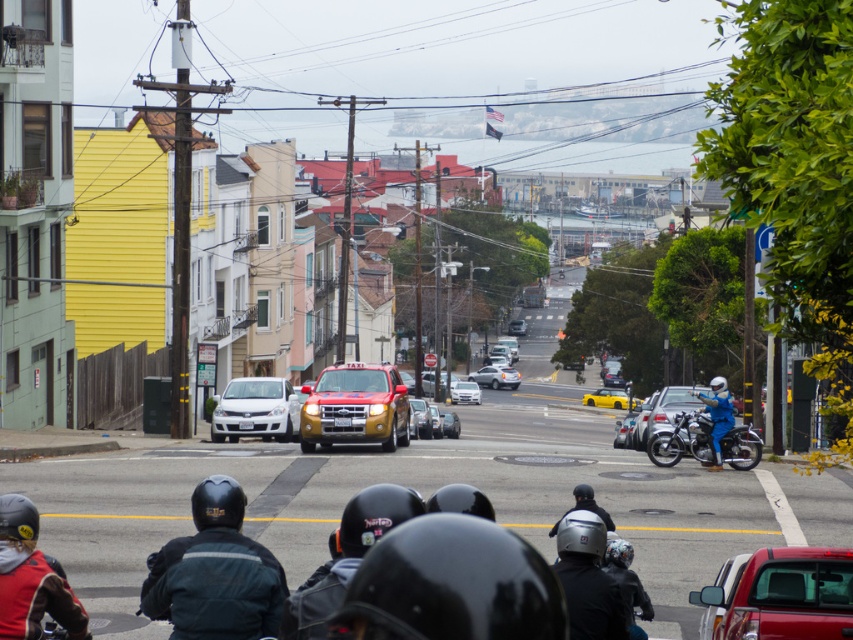
Can you confirm if satin white sedan at center is taller than satin silver sedan at center?

No.

Between satin white sedan at center and satin silver sedan at center, which one is positioned lower?

satin silver sedan at center is below.

What are the coordinates of `satin white sedan at center` in the screenshot? It's located at (256, 410).

Is shiny black helmet at center further to the viewer compared to metallic silver motorcycle at right?

That is False.

Does point (572, 572) come in front of point (643, 449)?

Yes, point (572, 572) is in front of point (643, 449).

Where is `shiny black helmet at center`? The image size is (853, 640). shiny black helmet at center is located at coordinates [587, 579].

Describe the element at coordinates (32, 577) in the screenshot. I see `red leather jacket at lower left` at that location.

Which is behind, point (67, 628) or point (659, 444)?

The point (659, 444) is behind.

Find the location of a particular element. This screenshot has width=853, height=640. red leather jacket at lower left is located at coordinates (32, 577).